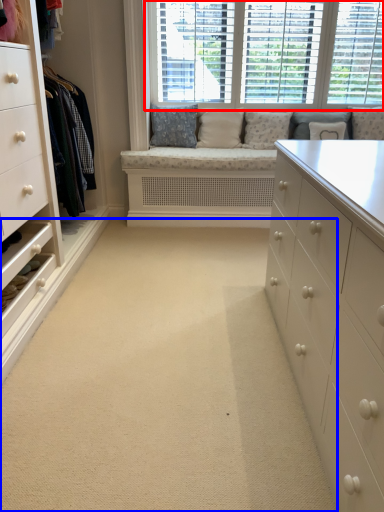
Question: Among these objects, which one is nearest to the camera, window (highlighted by a red box) or plain (highlighted by a blue box)?

Choices:
 (A) window
 (B) plain

Answer: (B)